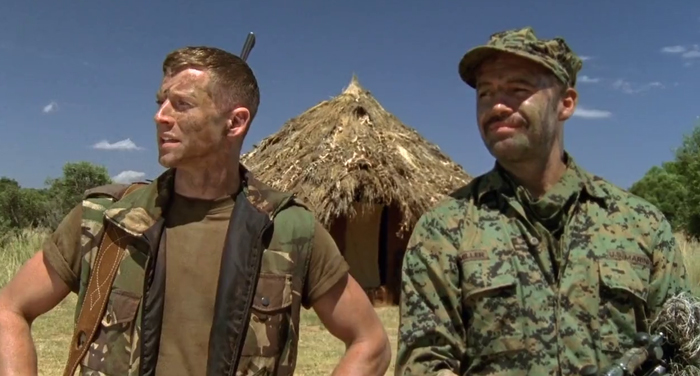
At what (x,y) coordinates should I click in order to perform the action: click on silver handle. Please return your answer as a coordinate pair (x, y). The height and width of the screenshot is (376, 700). Looking at the image, I should click on (248, 47).